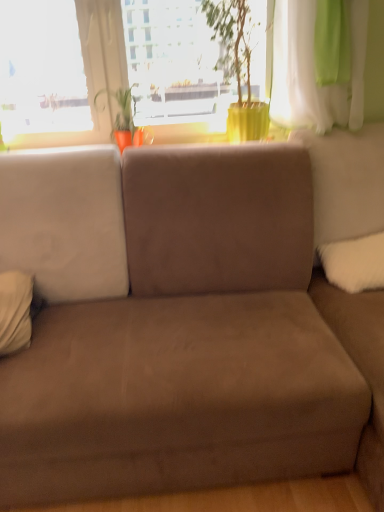
The width and height of the screenshot is (384, 512). What do you see at coordinates (175, 63) in the screenshot?
I see `green matte plant pot at upper center` at bounding box center [175, 63].

Image resolution: width=384 pixels, height=512 pixels. What do you see at coordinates (314, 69) in the screenshot?
I see `green sheer curtain at upper right` at bounding box center [314, 69].

Find the location of `transparent glass window at upper center`. transparent glass window at upper center is located at coordinates (92, 73).

What do you see at coordinates (15, 311) in the screenshot? This screenshot has height=512, width=384. I see `white soft pillow at left, which appears as the first pillow when viewed from the left` at bounding box center [15, 311].

Identify the location of green matte plant pot at upper center. Image resolution: width=384 pixels, height=512 pixels. (175, 63).

This screenshot has height=512, width=384. What are the coordinates of `window screen in front of the transparent glass window at upper center` in the screenshot? It's located at (175, 63).

Consider the image. Which is farther, (151, 29) or (92, 34)?

The point (151, 29) is behind.

Is green matte plant pot at upper center directly adjacent to transparent glass window at upper center?

No, green matte plant pot at upper center is not in contact with transparent glass window at upper center.

Is green matte plant pot at upper center smaller than transparent glass window at upper center?

Correct, green matte plant pot at upper center occupies less space than transparent glass window at upper center.

Is white fluffy pillow at right, acting as the 2th pillow starting from the left, completely or partially inside matte orange pot at center?

That's incorrect, white fluffy pillow at right, acting as the 2th pillow starting from the left, is not inside matte orange pot at center.

What's the angular difference between matte orange pot at center and white fluffy pillow at right, acting as the 2th pillow starting from the left,'s facing directions?

matte orange pot at center and white fluffy pillow at right, acting as the 2th pillow starting from the left, are facing 2.07 degrees away from each other.

Looking at this image, between matte orange pot at center and white fluffy pillow at right, acting as the 2th pillow starting from the left, which one has more height?

matte orange pot at center.

Between matte orange pot at center and white fluffy pillow at right, acting as the 2th pillow starting from the left, which one appears on the left side from the viewer's perspective?

Positioned to the left is matte orange pot at center.

Is white fluffy pillow at right, acting as the 2th pillow starting from the left, far away from matte orange pot at center?

Yes, white fluffy pillow at right, acting as the 2th pillow starting from the left, and matte orange pot at center are located far from each other.

From the image's perspective, between white fluffy pillow at right, acting as the 2th pillow starting from the left, and matte orange pot at center, which one is located above?

matte orange pot at center, from the image's perspective.

Between white fluffy pillow at right, the first pillow positioned from the right, and matte orange pot at center, which one appears on the right side from the viewer's perspective?

white fluffy pillow at right, the first pillow positioned from the right.

You are a GUI agent. You are given a task and a screenshot of the screen. Output one action in this format:
    pyautogui.click(x=<x>, y=<y>)
    Task: Click on the plant located behind the white fluffy pillow at right, the first pillow positioned from the right
    This screenshot has height=512, width=384.
    Given the screenshot: What is the action you would take?
    pyautogui.click(x=121, y=110)

From the picture: Who is taller, green matte plant pot at upper center or white soft pillow at left, which is counted as the second pillow, starting from the right?

Standing taller between the two is green matte plant pot at upper center.

Considering the sizes of green matte plant pot at upper center and white soft pillow at left, which appears as the first pillow when viewed from the left, in the image, is green matte plant pot at upper center wider or thinner than white soft pillow at left, which appears as the first pillow when viewed from the left,?

Considering their sizes, green matte plant pot at upper center looks broader than white soft pillow at left, which appears as the first pillow when viewed from the left.

From a real-world perspective, is green matte plant pot at upper center positioned above or below white soft pillow at left, which appears as the first pillow when viewed from the left?

From a real-world perspective, green matte plant pot at upper center is physically above white soft pillow at left, which appears as the first pillow when viewed from the left.

Is green matte plant pot at upper center positioned far away from white soft pillow at left, which appears as the first pillow when viewed from the left?

That's right, there is a large distance between green matte plant pot at upper center and white soft pillow at left, which appears as the first pillow when viewed from the left.

Is white soft pillow at left, which appears as the first pillow when viewed from the left, positioned in front of transparent glass window at upper center?

Yes, the depth of white soft pillow at left, which appears as the first pillow when viewed from the left, is less than that of transparent glass window at upper center.

How many degrees apart are the facing directions of white soft pillow at left, which is counted as the second pillow, starting from the right, and transparent glass window at upper center?

2.56 degrees.

Does point (19, 298) appear closer or farther from the camera than point (102, 136)?

Point (19, 298) is closer to the camera than point (102, 136).

The height and width of the screenshot is (512, 384). What are the coordinates of `window screen that appears above the matte orange pot at center (from the image's perspective)` in the screenshot? It's located at (175, 63).

Looking at the image, does green matte plant pot at upper center seem bigger or smaller compared to matte orange pot at center?

Clearly, green matte plant pot at upper center is larger in size than matte orange pot at center.

Can you tell me how much green matte plant pot at upper center and matte orange pot at center differ in facing direction?

3.59 degrees.

From the image's perspective, is green matte plant pot at upper center located beneath matte orange pot at center?

No.

In terms of height, does green sheer curtain at upper right look taller or shorter compared to matte orange pot at center?

green sheer curtain at upper right is taller than matte orange pot at center.

Does green sheer curtain at upper right come behind matte orange pot at center?

No, green sheer curtain at upper right is closer to the viewer.

Is green sheer curtain at upper right next to matte orange pot at center and touching it?

No, green sheer curtain at upper right is not with matte orange pot at center.

Is green sheer curtain at upper right not within matte orange pot at center?

green sheer curtain at upper right lies outside matte orange pot at center's area.

Identify the location of window located on the left of green matte plant pot at upper center. (92, 73).

You are a GUI agent. You are given a task and a screenshot of the screen. Output one action in this format:
    pyautogui.click(x=<x>, y=<y>)
    Task: Click on the pillow on the right of matte orange pot at center
    
    Given the screenshot: What is the action you would take?
    pyautogui.click(x=354, y=263)

From the image, which object appears to be nearer to white fluffy pillow at right, acting as the 2th pillow starting from the left, green sheer curtain at upper right or green matte plant pot at upper center?

green sheer curtain at upper right.

Based on their spatial positions, is matte orange pot at center or transparent glass window at upper center closer to green sheer curtain at upper right?

matte orange pot at center is positioned closer to the anchor green sheer curtain at upper right.

Considering their positions, is transparent glass window at upper center positioned closer to matte orange pot at center than green sheer curtain at upper right?

Among the two, transparent glass window at upper center is located nearer to matte orange pot at center.

Considering their positions, is white soft pillow at left, which appears as the first pillow when viewed from the left, positioned closer to green matte plant pot at upper center than white fluffy pillow at right, acting as the 2th pillow starting from the left?

white fluffy pillow at right, acting as the 2th pillow starting from the left, lies closer to green matte plant pot at upper center than the other object.

When comparing their distances from white fluffy pillow at right, the first pillow positioned from the right, does white soft pillow at left, which appears as the first pillow when viewed from the left, or green matte plant pot at upper center seem closer?

green matte plant pot at upper center.

Considering their positions, is transparent glass window at upper center positioned closer to white fluffy pillow at right, acting as the 2th pillow starting from the left, than white soft pillow at left, which appears as the first pillow when viewed from the left?

white soft pillow at left, which appears as the first pillow when viewed from the left, is positioned closer to the anchor white fluffy pillow at right, acting as the 2th pillow starting from the left.

Looking at the image, which one is located further to matte orange pot at center, white fluffy pillow at right, acting as the 2th pillow starting from the left, or white soft pillow at left, which appears as the first pillow when viewed from the left?

white fluffy pillow at right, acting as the 2th pillow starting from the left, is further to matte orange pot at center.

Which object lies nearer to the anchor point green sheer curtain at upper right, white fluffy pillow at right, the first pillow positioned from the right, or transparent glass window at upper center?

Among the two, white fluffy pillow at right, the first pillow positioned from the right, is located nearer to green sheer curtain at upper right.

The width and height of the screenshot is (384, 512). What are the coordinates of `window screen situated between matte orange pot at center and white fluffy pillow at right, the first pillow positioned from the right, from left to right` in the screenshot? It's located at (175, 63).

The height and width of the screenshot is (512, 384). What are the coordinates of `window between matte orange pot at center and green sheer curtain at upper right in the horizontal direction` in the screenshot? It's located at (92, 73).

Find the location of `plant between white soft pillow at left, which is counted as the second pillow, starting from the right, and white fluffy pillow at right, acting as the 2th pillow starting from the left, in the horizontal direction`. plant between white soft pillow at left, which is counted as the second pillow, starting from the right, and white fluffy pillow at right, acting as the 2th pillow starting from the left, in the horizontal direction is located at coordinates (121, 110).

Find the location of `window between matte orange pot at center and white fluffy pillow at right, the first pillow positioned from the right, from left to right`. window between matte orange pot at center and white fluffy pillow at right, the first pillow positioned from the right, from left to right is located at coordinates (92, 73).